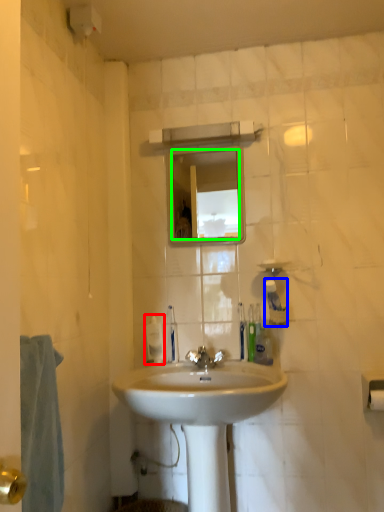
Question: Which object is positioned farthest from soap dispenser (highlighted by a red box)? Select from toiletry (highlighted by a blue box) and mirror (highlighted by a green box).

Choices:
 (A) toiletry
 (B) mirror

Answer: (B)